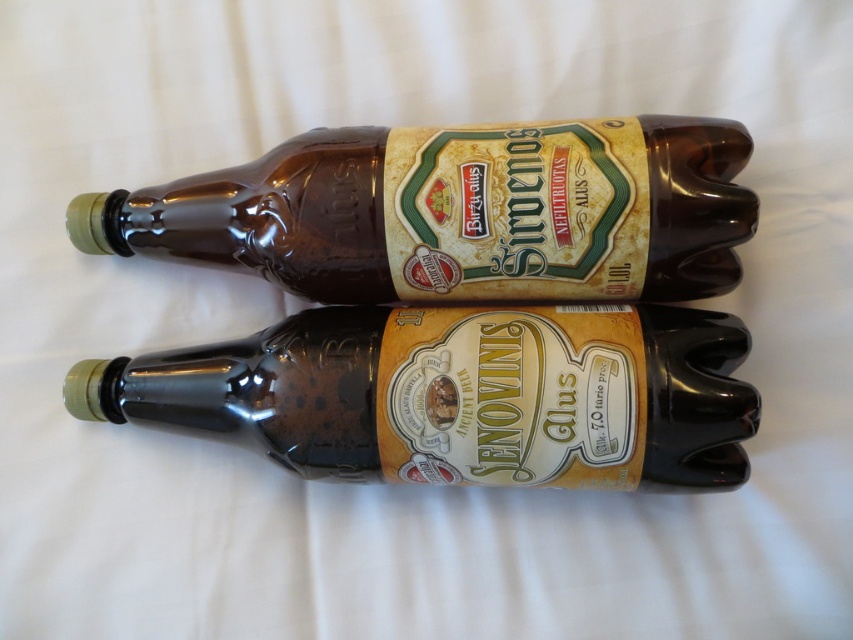
Question: Is shiny brown glass bottle at center to the right of brown glass bottle at center from the viewer's perspective?

Choices:
 (A) no
 (B) yes

Answer: (A)

Question: Is the position of shiny brown glass bottle at center less distant than that of brown glass bottle at center?

Choices:
 (A) yes
 (B) no

Answer: (B)

Question: Which of the following is the farthest from the observer?

Choices:
 (A) (347, 342)
 (B) (178, 237)

Answer: (B)

Question: Observing the image, what is the correct spatial positioning of shiny brown glass bottle at center in reference to brown glass bottle at center?

Choices:
 (A) above
 (B) below

Answer: (B)

Question: Which point is farther to the camera?

Choices:
 (A) brown glass bottle at center
 (B) shiny brown glass bottle at center

Answer: (B)